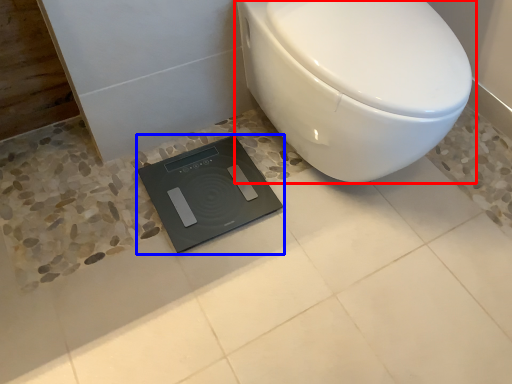
Question: Which object is further to the camera taking this photo, toilet (highlighted by a red box) or scale (highlighted by a blue box)?

Choices:
 (A) toilet
 (B) scale

Answer: (B)